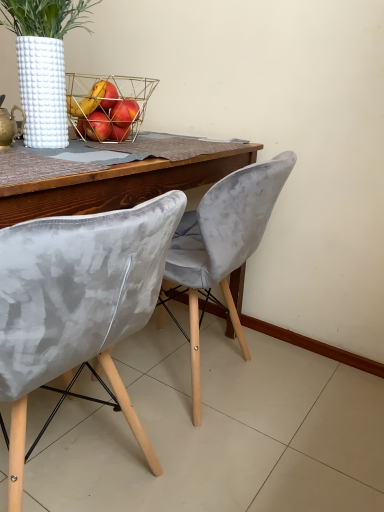
Find the location of a particular element. The image size is (384, 512). velvet grey chair at center, marked as the 2th chair in a front-to-back arrangement is located at coordinates (223, 243).

Locate an element on the screen. Image resolution: width=384 pixels, height=512 pixels. white textured vase at upper left is located at coordinates (43, 62).

The width and height of the screenshot is (384, 512). I want to click on velvet grey chair at center, which is the 1th chair in back-to-front order, so click(223, 243).

From a real-world perspective, relative to gold metallic teapot at upper left, is white textured vase at upper left vertically above or below?

white textured vase at upper left is situated higher than gold metallic teapot at upper left in the real world.

Can you confirm if white textured vase at upper left is bigger than gold metallic teapot at upper left?

Indeed, white textured vase at upper left has a larger size compared to gold metallic teapot at upper left.

From the image's perspective, between white textured vase at upper left and gold metallic teapot at upper left, who is located below?

gold metallic teapot at upper left.

Between white textured vase at upper left and gold metallic teapot at upper left, which one appears on the right side from the viewer's perspective?

white textured vase at upper left.

Looking at this image, is velvet grey chair at center, the first chair from the front, turned away from white textured vase at upper left?

No, velvet grey chair at center, the first chair from the front, is not facing away from white textured vase at upper left.

Which is farther from the camera, (74, 361) or (22, 53)?

The point (22, 53) is more distant.

Can you tell me how much velvet grey chair at center, placed as the 2th chair when sorted from back to front, and white textured vase at upper left differ in facing direction?

The angle between the facing direction of velvet grey chair at center, placed as the 2th chair when sorted from back to front, and the facing direction of white textured vase at upper left is 89.9 degrees.

Which object is more forward, velvet grey chair at center, marked as the 2th chair in a front-to-back arrangement, or white textured vase at upper left?

white textured vase at upper left is in front.

Considering the sizes of objects velvet grey chair at center, which is the 1th chair in back-to-front order, and white textured vase at upper left in the image provided, who is shorter, velvet grey chair at center, which is the 1th chair in back-to-front order, or white textured vase at upper left?

white textured vase at upper left.

Is the surface of velvet grey chair at center, marked as the 2th chair in a front-to-back arrangement, in direct contact with white textured vase at upper left?

No, velvet grey chair at center, marked as the 2th chair in a front-to-back arrangement, is not next to white textured vase at upper left.

Is gold metallic teapot at upper left aimed at velvet grey chair at center, the first chair from the front?

No, gold metallic teapot at upper left is not facing towards velvet grey chair at center, the first chair from the front.

Considering the positions of points (0, 148) and (16, 317), is point (0, 148) closer to camera compared to point (16, 317)?

That is False.

Which of these two, gold metallic teapot at upper left or velvet grey chair at center, placed as the 2th chair when sorted from back to front, is wider?

Wider between the two is velvet grey chair at center, placed as the 2th chair when sorted from back to front.

Can you confirm if gold metallic teapot at upper left is smaller than velvet grey chair at center, the first chair from the front?

Yes.

In the scene shown: Is velvet grey chair at center, the first chair from the front, in contact with velvet grey chair at center, which is the 1th chair in back-to-front order?

They are not placed beside each other.

Between velvet grey chair at center, the first chair from the front, and velvet grey chair at center, which is the 1th chair in back-to-front order, which one has more height?

velvet grey chair at center, which is the 1th chair in back-to-front order, is taller.

Considering the sizes of objects velvet grey chair at center, the first chair from the front, and velvet grey chair at center, marked as the 2th chair in a front-to-back arrangement, in the image provided, who is wider, velvet grey chair at center, the first chair from the front, or velvet grey chair at center, marked as the 2th chair in a front-to-back arrangement,?

velvet grey chair at center, the first chair from the front, is wider.

In terms of size, does velvet grey chair at center, the first chair from the front, appear bigger or smaller than velvet grey chair at center, marked as the 2th chair in a front-to-back arrangement?

Clearly, velvet grey chair at center, the first chair from the front, is larger in size than velvet grey chair at center, marked as the 2th chair in a front-to-back arrangement.

From the picture: How far apart are velvet grey chair at center, placed as the 2th chair when sorted from back to front, and gold wire basket at center?

velvet grey chair at center, placed as the 2th chair when sorted from back to front, and gold wire basket at center are 27.96 inches apart.

Is point (119, 338) closer or farther from the camera than point (87, 93)?

Point (119, 338) is positioned closer to the camera compared to point (87, 93).

Can you tell me how much velvet grey chair at center, placed as the 2th chair when sorted from back to front, and gold wire basket at center differ in facing direction?

They differ by 90.4 degrees in their facing directions.

Is velvet grey chair at center, the first chair from the front, directly adjacent to gold wire basket at center?

No, velvet grey chair at center, the first chair from the front, is not touching gold wire basket at center.

Considering the relative positions of white textured vase at upper left and velvet grey chair at center, placed as the 2th chair when sorted from back to front, in the image provided, is white textured vase at upper left in front of velvet grey chair at center, placed as the 2th chair when sorted from back to front,?

No, it is not.

Considering the relative sizes of white textured vase at upper left and velvet grey chair at center, placed as the 2th chair when sorted from back to front, in the image provided, is white textured vase at upper left taller than velvet grey chair at center, placed as the 2th chair when sorted from back to front,?

No, white textured vase at upper left is not taller than velvet grey chair at center, placed as the 2th chair when sorted from back to front.

Is white textured vase at upper left wider or thinner than velvet grey chair at center, placed as the 2th chair when sorted from back to front?

white textured vase at upper left is thinner than velvet grey chair at center, placed as the 2th chair when sorted from back to front.

I want to click on tea pot that appears behind the white textured vase at upper left, so click(9, 125).

At what (x,y) coordinates should I click in order to perform the action: click on houseplant on the left of velvet grey chair at center, the first chair from the front. Please return your answer as a coordinate pair (x, y). The height and width of the screenshot is (512, 384). Looking at the image, I should click on (43, 62).

From the image, which object appears to be farther from velvet grey chair at center, the first chair from the front, gold metallic teapot at upper left or white textured vase at upper left?

white textured vase at upper left is further to velvet grey chair at center, the first chair from the front.

Considering their positions, is gold metallic teapot at upper left positioned further to gold wire basket at center than white textured vase at upper left?

The object further to gold wire basket at center is gold metallic teapot at upper left.

Based on their spatial positions, is velvet grey chair at center, marked as the 2th chair in a front-to-back arrangement, or gold wire basket at center closer to velvet grey chair at center, placed as the 2th chair when sorted from back to front?

→ velvet grey chair at center, marked as the 2th chair in a front-to-back arrangement, lies closer to velvet grey chair at center, placed as the 2th chair when sorted from back to front, than the other object.

Estimate the real-world distances between objects in this image. Which object is closer to velvet grey chair at center, which is the 1th chair in back-to-front order, white textured vase at upper left or gold metallic teapot at upper left?

white textured vase at upper left is positioned closer to the anchor velvet grey chair at center, which is the 1th chair in back-to-front order.

Consider the image. Based on their spatial positions, is gold metallic teapot at upper left or white textured vase at upper left closer to velvet grey chair at center, which is the 1th chair in back-to-front order?

Based on the image, white textured vase at upper left appears to be nearer to velvet grey chair at center, which is the 1th chair in back-to-front order.

Based on the photo, based on their spatial positions, is velvet grey chair at center, placed as the 2th chair when sorted from back to front, or velvet grey chair at center, which is the 1th chair in back-to-front order, further from gold metallic teapot at upper left?

velvet grey chair at center, which is the 1th chair in back-to-front order, lies further to gold metallic teapot at upper left than the other object.

Estimate the real-world distances between objects in this image. Which object is closer to velvet grey chair at center, which is the 1th chair in back-to-front order, white textured vase at upper left or gold wire basket at center?

The object closer to velvet grey chair at center, which is the 1th chair in back-to-front order, is gold wire basket at center.

When comparing their distances from velvet grey chair at center, marked as the 2th chair in a front-to-back arrangement, does velvet grey chair at center, the first chair from the front, or gold wire basket at center seem further?

The object further to velvet grey chair at center, marked as the 2th chair in a front-to-back arrangement, is gold wire basket at center.

At what (x,y) coordinates should I click in order to perform the action: click on chair that lies between gold wire basket at center and velvet grey chair at center, the first chair from the front, from top to bottom. Please return your answer as a coordinate pair (x, y). This screenshot has height=512, width=384. Looking at the image, I should click on (223, 243).

At what (x,y) coordinates should I click in order to perform the action: click on tea pot between white textured vase at upper left and velvet grey chair at center, the first chair from the front, vertically. Please return your answer as a coordinate pair (x, y). This screenshot has width=384, height=512. Looking at the image, I should click on (9, 125).

Identify the location of tea pot between gold wire basket at center and velvet grey chair at center, which is the 1th chair in back-to-front order, from top to bottom. Image resolution: width=384 pixels, height=512 pixels. (9, 125).

This screenshot has width=384, height=512. What are the coordinates of `tea pot that lies between white textured vase at upper left and velvet grey chair at center, which is the 1th chair in back-to-front order, from top to bottom` in the screenshot? It's located at (9, 125).